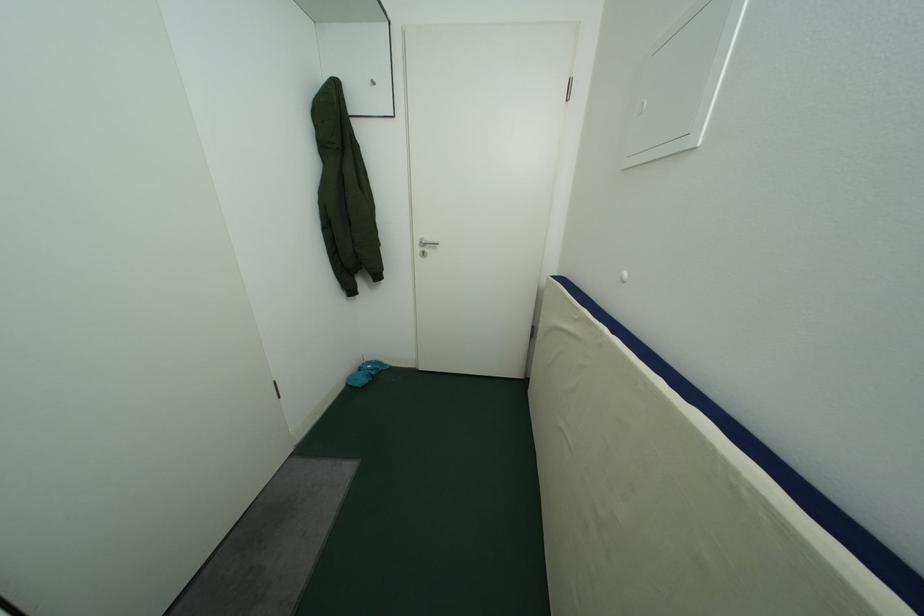
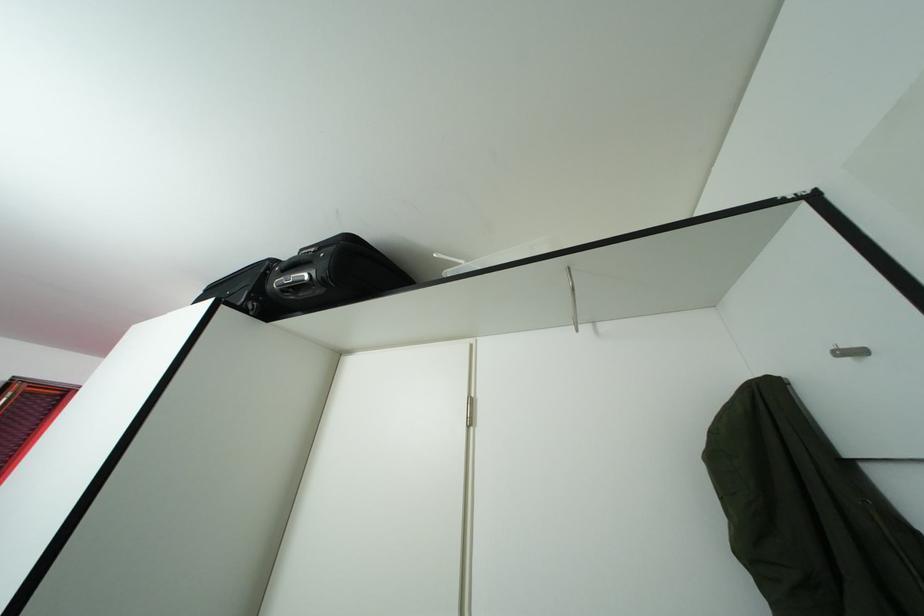
In the second image, find the point that corresponds to (383,90) in the first image.

(861, 360)